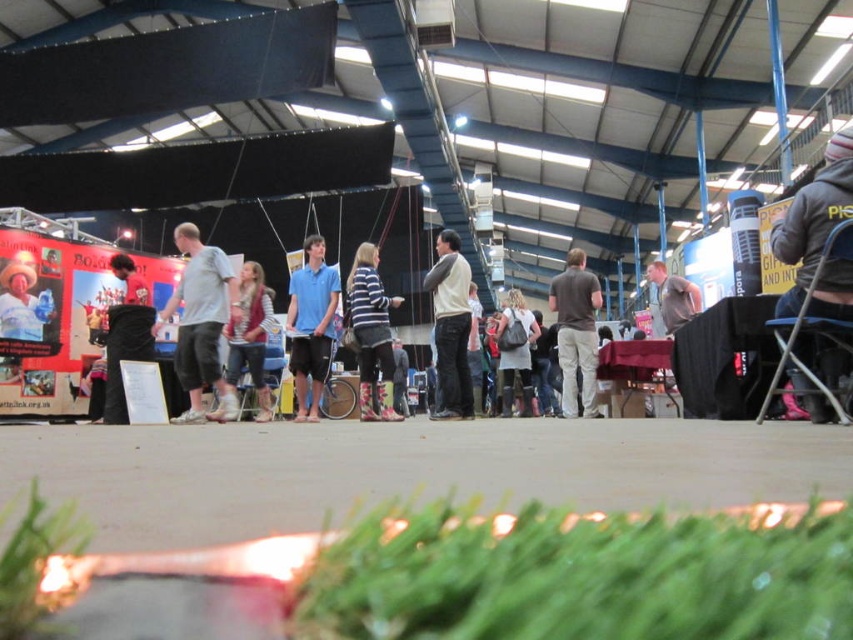
Question: Which point is closer to the camera?

Choices:
 (A) green leafy grass at lower left
 (B) fluffy beige backpack at center
 (C) brown cotton shirt at center

Answer: (A)

Question: Which is nearer to the brown cotton shirt at center?

Choices:
 (A) fluffy beige backpack at center
 (B) blue cotton shirt at center
 (C) denim jacket at center

Answer: (A)

Question: Can you confirm if light gray cotton shirt at center is smaller than fluffy beige backpack at center?

Choices:
 (A) no
 (B) yes

Answer: (B)

Question: Is blue cotton shirt at center closer to camera compared to gray matte shirt at center?

Choices:
 (A) no
 (B) yes

Answer: (B)

Question: Does green leafy grass at lower left appear on the right side of striped sweater at center?

Choices:
 (A) yes
 (B) no

Answer: (A)

Question: Which is nearer to the blue cotton shirt at center?

Choices:
 (A) fluffy beige backpack at center
 (B) brown cotton shirt at center

Answer: (B)